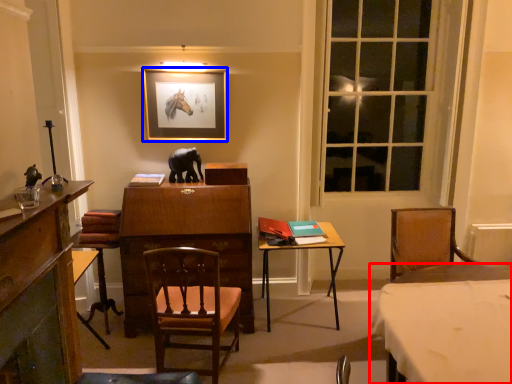
Question: Which of the following is the closest to the observer, table (highlighted by a red box) or picture frame (highlighted by a blue box)?

Choices:
 (A) table
 (B) picture frame

Answer: (A)